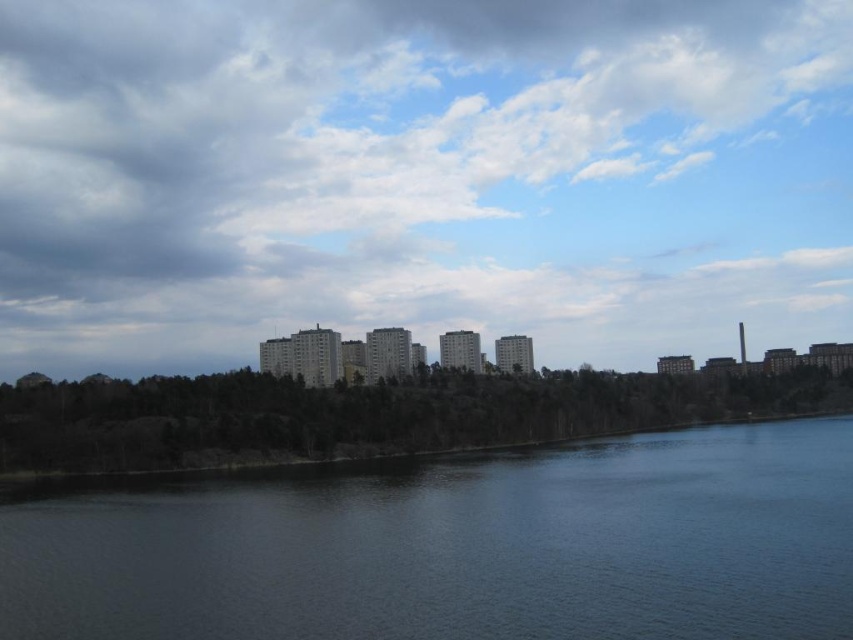
Does point (630, 467) lie behind point (107, 467)?

That is False.

Can you confirm if dark blue water at lower center is positioned above green matte trees at lower center?

No.

Is point (647, 598) closer to viewer compared to point (177, 419)?

Yes, point (647, 598) is closer to viewer.

You are a GUI agent. You are given a task and a screenshot of the screen. Output one action in this format:
    pyautogui.click(x=<x>, y=<y>)
    Task: Click on the dark blue water at lower center
    This screenshot has width=853, height=640.
    Given the screenshot: What is the action you would take?
    pyautogui.click(x=462, y=547)

Does cloudy sky at center have a greater width compared to dark blue water at lower center?

Yes.

Is point (505, 99) positioned behind point (375, 573)?

Yes.

Identify the location of cloudy sky at center. (421, 176).

Who is higher up, cloudy sky at center or green matte trees at lower center?

cloudy sky at center

Is point (836, 115) positioned behind point (151, 448)?

Yes, it is.

The image size is (853, 640). What are the coordinates of `cloudy sky at center` in the screenshot? It's located at (421, 176).